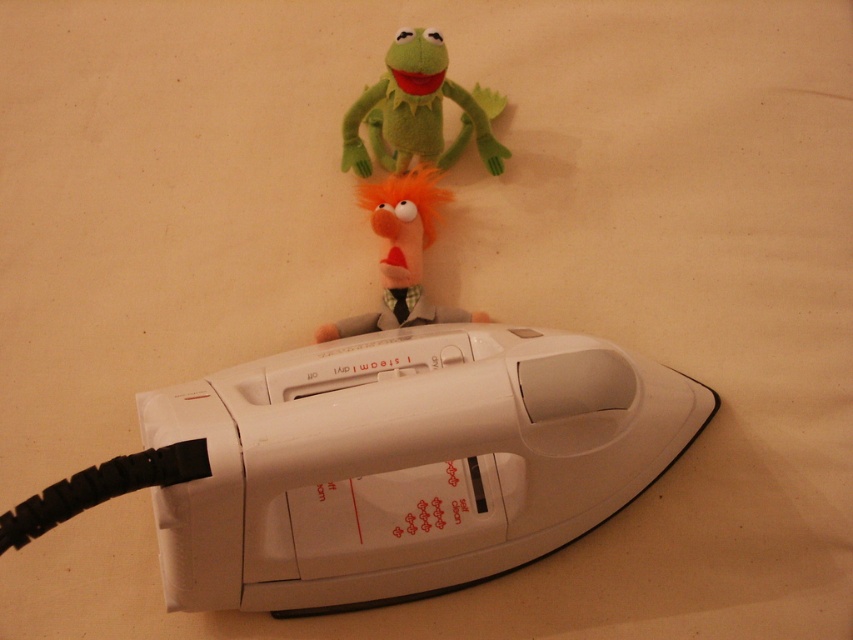
You are organizing a toy collection and need to place the green plush frog at upper center and the orange fuzzy puppet at center into a storage box. Which toy requires more horizontal space?

The orange fuzzy puppet at center requires more horizontal space because it has a greater width than the green plush frog at upper center.

You are organizing a childrens party and need to arrange the green plush frog at upper center and orange fuzzy puppet at center on a shelf. The shelf has a height limit of 10 cm. Can both toys fit on the shelf without exceeding the height limit?

The green plush frog at upper center is shorter than the orange fuzzy puppet at center. Since the shelf has a height limit of 10 cm, both toys can fit as long as the taller orange fuzzy puppet at center is under 10 cm. However, the exact heights are not provided, so we cannot confirm definitively without measuring them.